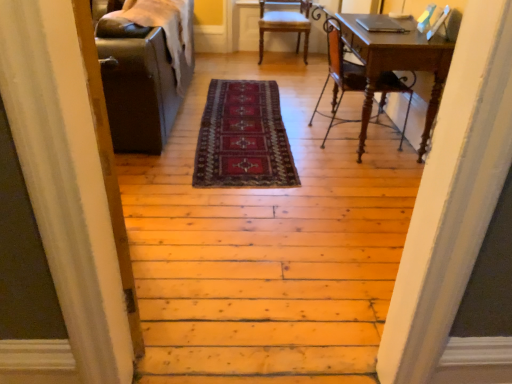
Question: From the image's perspective, relative to dark red woven rug at center, is wooden desk at right above or below?

Choices:
 (A) above
 (B) below

Answer: (A)

Question: Considering the positions of point (361, 16) and point (256, 168), is point (361, 16) closer or farther from the camera than point (256, 168)?

Choices:
 (A) closer
 (B) farther

Answer: (B)

Question: Estimate the real-world distances between objects in this image. Which object is closer to the wooden chair at right, placed as the second chair when sorted from back to front?

Choices:
 (A) wooden floor at center
 (B) wooden chair at center, which appears as the 2th chair when ordered from the bottom
 (C) wooden desk at right
 (D) dark red woven rug at center

Answer: (C)

Question: Estimate the real-world distances between objects in this image. Which object is farther from the wooden chair at right, the second chair from the top?

Choices:
 (A) wooden floor at center
 (B) dark red woven rug at center
 (C) wooden chair at center, which appears as the 2th chair when ordered from the bottom
 (D) wooden desk at right

Answer: (C)